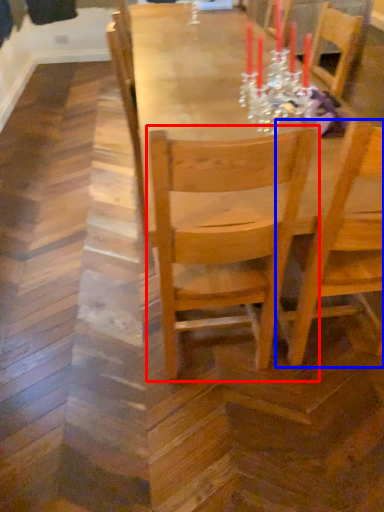
Question: Which object appears closest to the camera in this image, chair (highlighted by a red box) or chair (highlighted by a blue box)?

Choices:
 (A) chair
 (B) chair

Answer: (A)